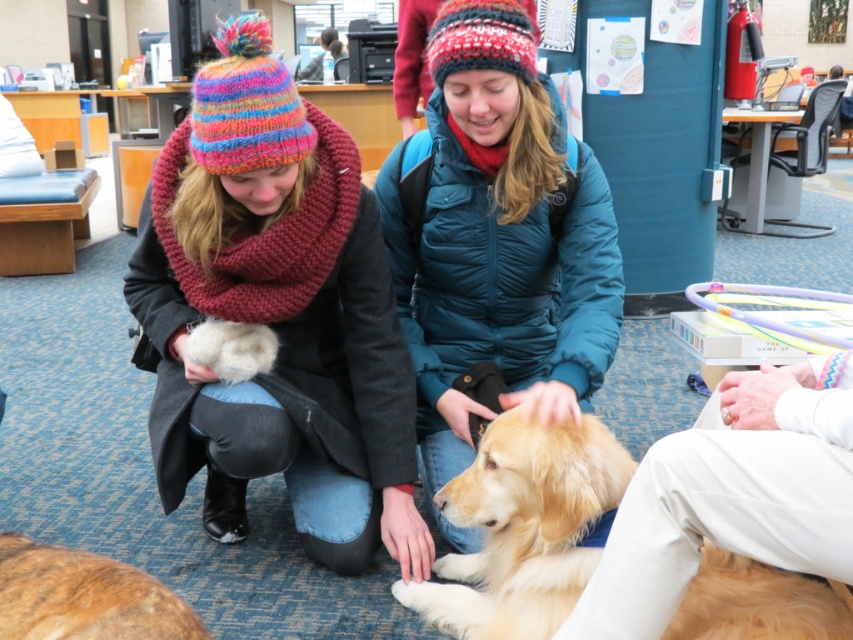
Can you confirm if knitted woolen hat at upper left is taller than matte teal jacket at center?

Yes, knitted woolen hat at upper left is taller than matte teal jacket at center.

Is point (190, 298) positioned after point (421, 195)?

No, (190, 298) is in front of (421, 195).

Find the location of `knitted woolen hat at upper left`. knitted woolen hat at upper left is located at coordinates (276, 316).

What do you see at coordinates (524, 529) in the screenshot? Image resolution: width=853 pixels, height=640 pixels. I see `golden fur dog at center` at bounding box center [524, 529].

Locate an element on the screen. This screenshot has width=853, height=640. golden fur dog at center is located at coordinates [524, 529].

Find the location of `golden fur dog at center`. golden fur dog at center is located at coordinates (524, 529).

Which is below, knitted woolen hat at upper left or golden fur dog at center?

golden fur dog at center is lower down.

What do you see at coordinates (276, 316) in the screenshot? Image resolution: width=853 pixels, height=640 pixels. I see `knitted woolen hat at upper left` at bounding box center [276, 316].

Is point (183, 476) closer to camera compared to point (747, 586)?

That is False.

You are a GUI agent. You are given a task and a screenshot of the screen. Output one action in this format:
    pyautogui.click(x=<x>, y=<y>)
    Task: Click on the knitted woolen hat at upper left
    
    Given the screenshot: What is the action you would take?
    pyautogui.click(x=276, y=316)